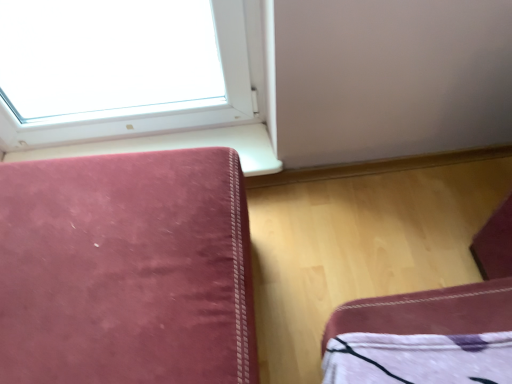
Identify the location of velvet-like pink sofa at left. (126, 270).

Image resolution: width=512 pixels, height=384 pixels. What do you see at coordinates (126, 270) in the screenshot? I see `velvet-like pink sofa at left` at bounding box center [126, 270].

In order to face velvet-like pink cushion at lower left, should I rotate leftwards or rightwards?

To align with it, rotate left about 15.801°.

Image resolution: width=512 pixels, height=384 pixels. In order to click on velvet-like pink cushion at lower left in this screenshot , I will do (176, 147).

Describe the element at coordinates (176, 147) in the screenshot. I see `velvet-like pink cushion at lower left` at that location.

Measure the distance between velvet-like pink cushion at lower left and camera.

velvet-like pink cushion at lower left is 3.88 feet away from camera.

Locate an element on the screen. velvet-like pink sofa at left is located at coordinates (126, 270).

Is velvet-like pink sofa at left at the left side of velvet-like pink cushion at lower left?

Yes.

Between velvet-like pink sofa at left and velvet-like pink cushion at lower left, which one is positioned behind?

velvet-like pink cushion at lower left is more distant.

Considering the points (61, 314) and (255, 160), which point is in front, point (61, 314) or point (255, 160)?

The point (61, 314) is in front.

From the image's perspective, which object appears higher, velvet-like pink sofa at left or velvet-like pink cushion at lower left?

velvet-like pink cushion at lower left appears higher in the image.

From a real-world perspective, is velvet-like pink sofa at left on top of velvet-like pink cushion at lower left?

Yes, from a real-world perspective, velvet-like pink sofa at left is above velvet-like pink cushion at lower left.

Looking at their sizes, would you say velvet-like pink sofa at left is wider or thinner than velvet-like pink cushion at lower left?

Clearly, velvet-like pink sofa at left has more width compared to velvet-like pink cushion at lower left.

Based on the photo, is velvet-like pink sofa at left taller than velvet-like pink cushion at lower left?

Indeed, velvet-like pink sofa at left has a greater height compared to velvet-like pink cushion at lower left.

Looking at the image, does velvet-like pink sofa at left seem bigger or smaller compared to velvet-like pink cushion at lower left?

velvet-like pink sofa at left is bigger than velvet-like pink cushion at lower left.

Is velvet-like pink sofa at left completely or partially outside of velvet-like pink cushion at lower left?

Yes, velvet-like pink sofa at left is outside of velvet-like pink cushion at lower left.

Are velvet-like pink sofa at left and velvet-like pink cushion at lower left beside each other?

velvet-like pink sofa at left and velvet-like pink cushion at lower left are clearly separated.

Is velvet-like pink sofa at left positioned with its back to velvet-like pink cushion at lower left?

Yes, velvet-like pink sofa at left's orientation is away from velvet-like pink cushion at lower left.

How different are the orientations of velvet-like pink sofa at left and velvet-like pink cushion at lower left in degrees?

The angular difference between velvet-like pink sofa at left and velvet-like pink cushion at lower left is 1.77 degrees.

Locate an element on the screen. The width and height of the screenshot is (512, 384). window sill on the right of velvet-like pink sofa at left is located at coordinates pos(176,147).

From the picture: Is velvet-like pink cushion at lower left to the left of velvet-like pink sofa at left from the viewer's perspective?

No.

Which object is more forward, velvet-like pink cushion at lower left or velvet-like pink sofa at left?

velvet-like pink sofa at left is more forward.

Considering the positions of points (219, 133) and (18, 363), is point (219, 133) closer to camera compared to point (18, 363)?

No, it is not.

From the image's perspective, is velvet-like pink cushion at lower left located above or below velvet-like pink sofa at left?

Clearly, from the image's perspective, velvet-like pink cushion at lower left is above velvet-like pink sofa at left.

From a real-world perspective, is velvet-like pink cushion at lower left positioned above or below velvet-like pink sofa at left?

velvet-like pink cushion at lower left is below velvet-like pink sofa at left.

Is velvet-like pink cushion at lower left wider or thinner than velvet-like pink sofa at left?

Considering their sizes, velvet-like pink cushion at lower left looks slimmer than velvet-like pink sofa at left.

Considering the sizes of velvet-like pink cushion at lower left and velvet-like pink sofa at left in the image, is velvet-like pink cushion at lower left taller or shorter than velvet-like pink sofa at left?

In the image, velvet-like pink cushion at lower left appears to be shorter than velvet-like pink sofa at left.

Considering the relative sizes of velvet-like pink cushion at lower left and velvet-like pink sofa at left in the image provided, is velvet-like pink cushion at lower left smaller than velvet-like pink sofa at left?

Indeed, velvet-like pink cushion at lower left has a smaller size compared to velvet-like pink sofa at left.

Is velvet-like pink cushion at lower left completely or partially outside of velvet-like pink sofa at left?

That's correct, velvet-like pink cushion at lower left is outside of velvet-like pink sofa at left.

Is velvet-like pink cushion at lower left positioned far away from velvet-like pink sofa at left?

velvet-like pink cushion at lower left is near velvet-like pink sofa at left, not far away.

Is velvet-like pink cushion at lower left looking in the opposite direction of velvet-like pink sofa at left?

No.

How different are the orientations of velvet-like pink cushion at lower left and velvet-like pink sofa at left in degrees?

1.77 degrees separate the facing orientations of velvet-like pink cushion at lower left and velvet-like pink sofa at left.

This screenshot has width=512, height=384. What are the coordinates of `furniture that appears in front of the velvet-like pink cushion at lower left` in the screenshot? It's located at (126, 270).

Identify the location of window sill above the velvet-like pink sofa at left (from the image's perspective). The image size is (512, 384). (176, 147).

Locate an element on the screen. furniture located on the left of velvet-like pink cushion at lower left is located at coordinates (126, 270).